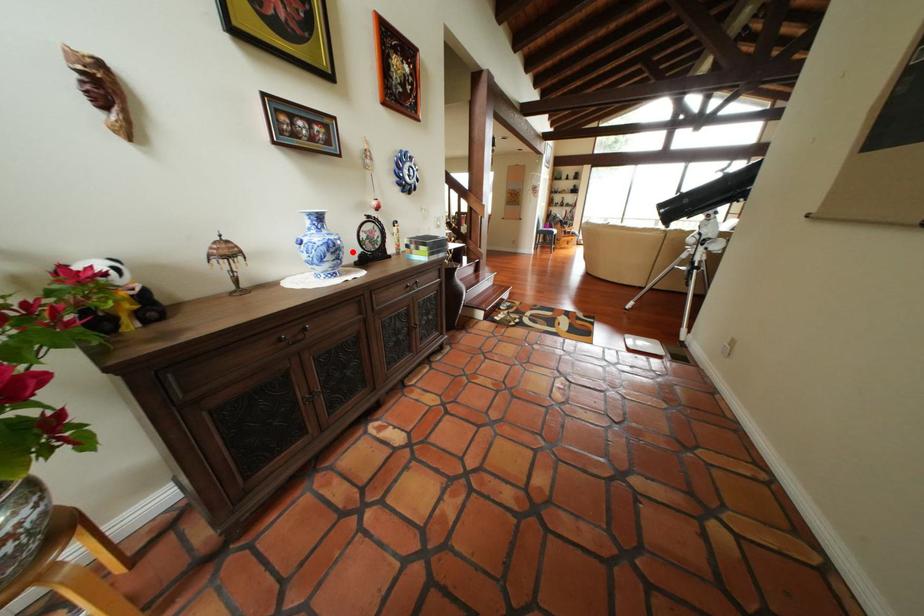
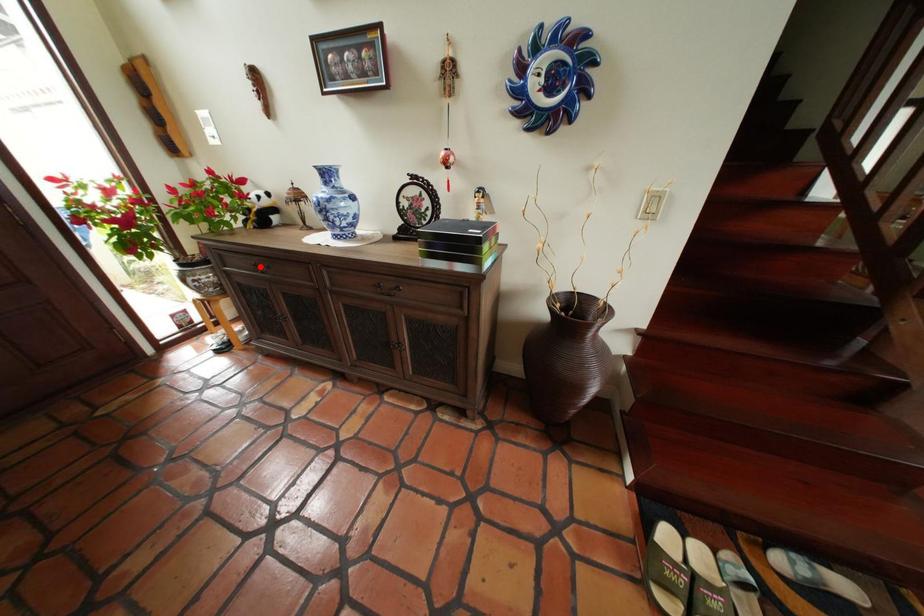
I am providing you with two images of the same scene from different viewpoints. A red point is marked on the first image and another point is marked on the second image. Do the highlighted points in image1 and image2 indicate the same real-world spot?

No